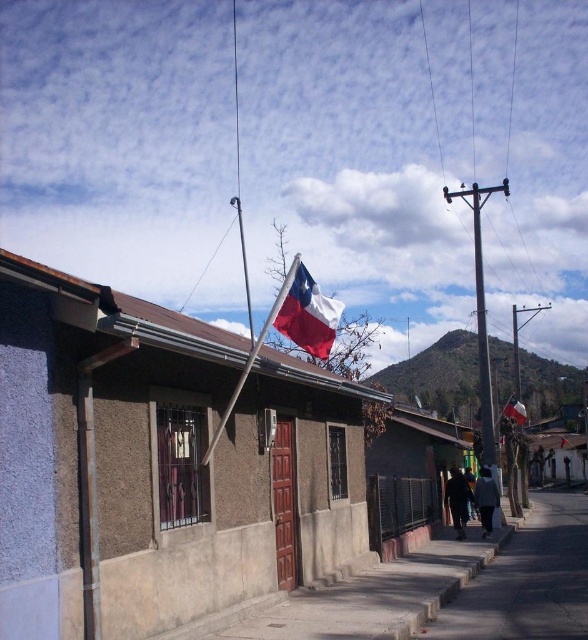
You are a surveyor measuring the distance between two flags in a town square. The flags are the polished fabric flag at center and the polished wood flag at center. The town requires that the distance between these two flags must be exactly 15 meters for a parade route. Is the current distance compliant with the requirement?

The distance between the polished fabric flag at center and the polished wood flag at center is 17.16 meters, which is longer than the required 15 meters. Therefore, the current distance does not comply with the town square requirement.